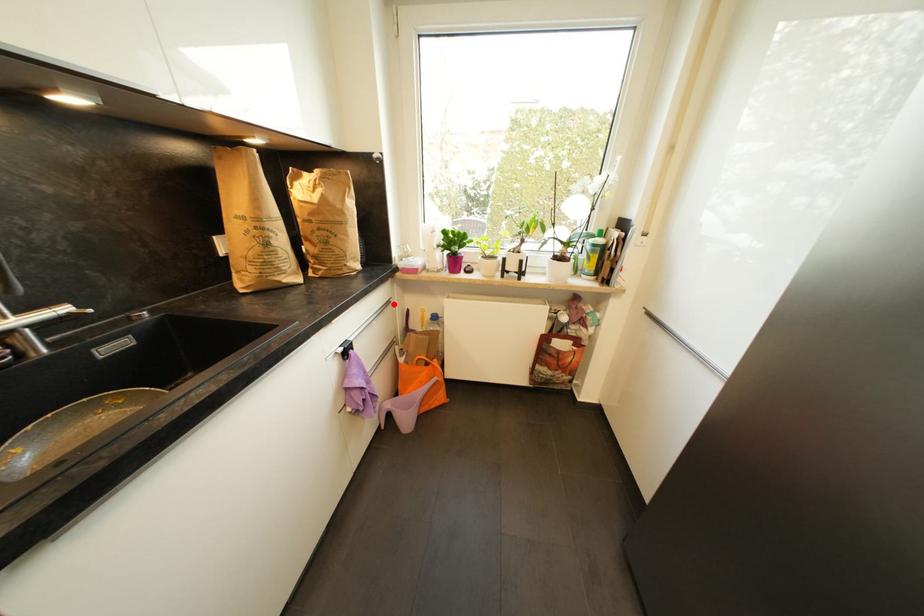
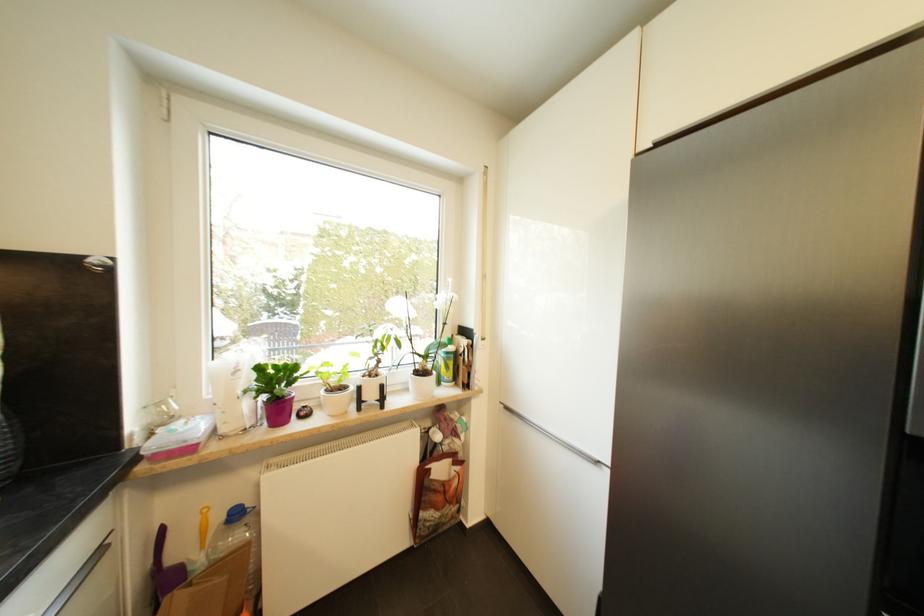
Locate, in the second image, the point that corresponds to the highlighted location in the first image.

(105, 553)